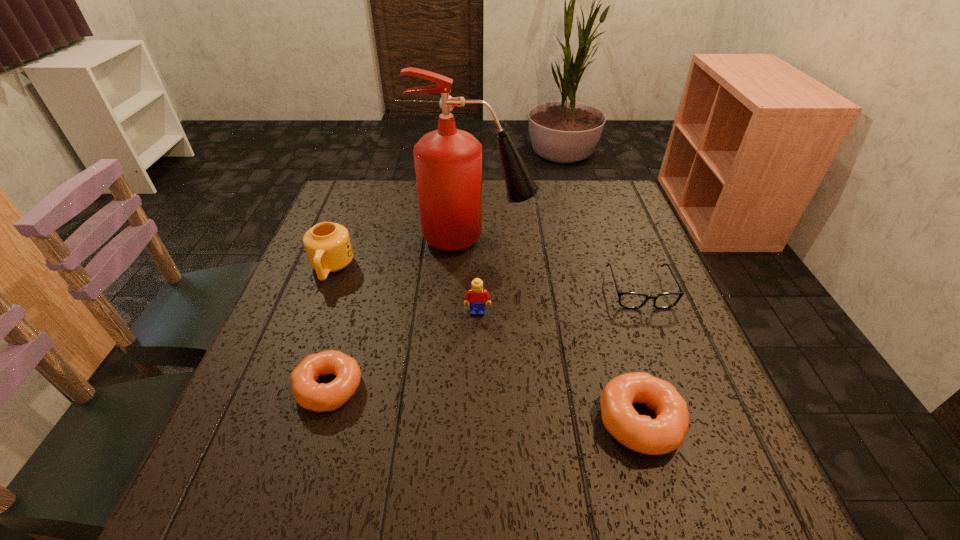
This screenshot has height=540, width=960. In order to click on the shorter doughnut in this screenshot , I will do `click(309, 394)`.

Where is `the taller doughnut`? the taller doughnut is located at coordinates (667, 432).

The image size is (960, 540). In order to click on the right doughnut in this screenshot , I will do `click(667, 432)`.

Find the location of `the tallest object`. the tallest object is located at coordinates (448, 162).

Find the location of a particular element. This screenshot has height=540, width=960. spectacles is located at coordinates (632, 300).

The width and height of the screenshot is (960, 540). I want to click on mug, so click(328, 247).

You are a GUI agent. You are given a task and a screenshot of the screen. Output one action in this format:
    pyautogui.click(x=<x>, y=<y>)
    Task: Click on the Lego
    
    Given the screenshot: What is the action you would take?
    pyautogui.click(x=476, y=295)

The height and width of the screenshot is (540, 960). What are the coordinates of `vacant space positioned 0.210m on the back of the left doughnut` in the screenshot? It's located at (358, 288).

Locate an element on the screen. The height and width of the screenshot is (540, 960). vacant region located on the back of the taller doughnut is located at coordinates (600, 285).

Image resolution: width=960 pixels, height=540 pixels. What are the coordinates of `vacant space situated 0.200m with the nozzle aimed from the fire extinguisher` in the screenshot? It's located at (609, 239).